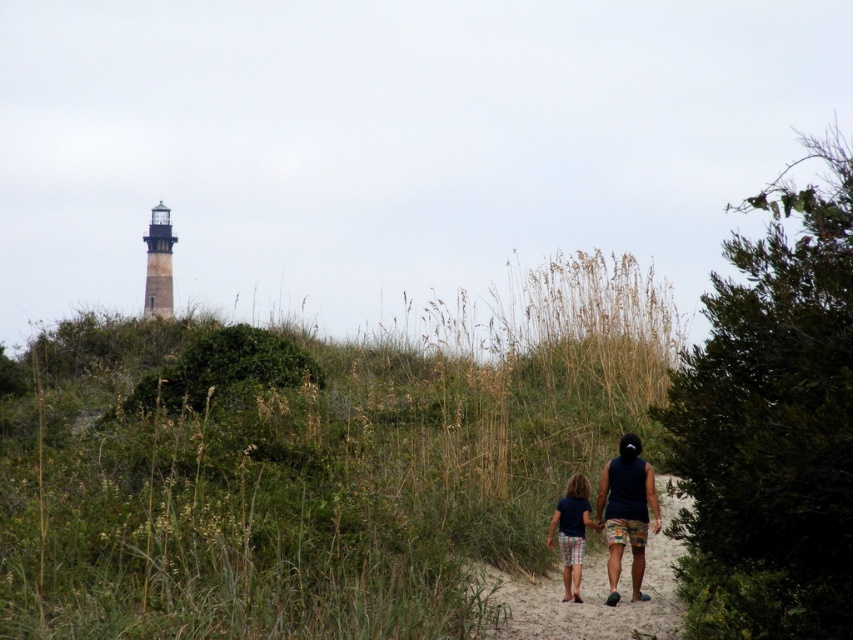
Question: Which of these objects is positioned farthest from the dark blue tank top at center?

Choices:
 (A) green grassy at center
 (B) textured sand path at center

Answer: (A)

Question: Which point appears farthest from the camera in this image?

Choices:
 (A) [677, 554]
 (B) [552, 524]

Answer: (A)

Question: Can you confirm if textured sand path at center is positioned below dark blue tank top at center?

Choices:
 (A) no
 (B) yes

Answer: (B)

Question: Can you confirm if textured sand path at center is positioned to the right of dark blue tank top at center?

Choices:
 (A) yes
 (B) no

Answer: (B)

Question: Is dark blue tank top at center positioned before plaid shorts at center?

Choices:
 (A) no
 (B) yes

Answer: (B)

Question: Which object is closer to the camera taking this photo?

Choices:
 (A) green grassy at center
 (B) dark blue tank top at center
 (C) textured sand path at center
 (D) plaid shorts at center

Answer: (A)